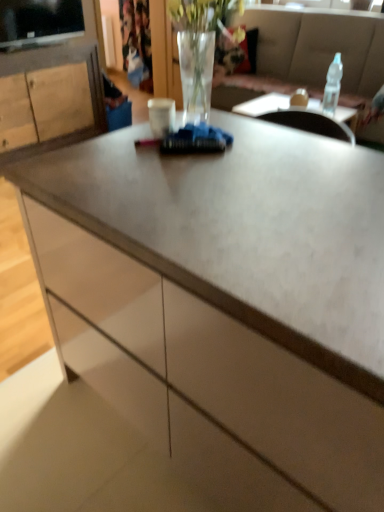
The image size is (384, 512). Identify the location of translucent glass vase at upper center. (229, 47).

What do you see at coordinates (200, 47) in the screenshot? I see `clear glass vase at center` at bounding box center [200, 47].

In order to face clear plastic bottle at upper right, should I rotate leftwards or rightwards?

A 18.388 degree turn to the right will do.

The image size is (384, 512). What do you see at coordinates (319, 45) in the screenshot? I see `matte gray couch at upper center` at bounding box center [319, 45].

You are a GUI agent. You are given a task and a screenshot of the screen. Output one action in this format:
    pyautogui.click(x=<x>, y=<y>)
    Task: Click on the black glossy television at upper left
    
    Given the screenshot: What is the action you would take?
    pyautogui.click(x=39, y=21)

Are black glossy television at upper left and matte gray couch at upper center making contact?

No, black glossy television at upper left is not with matte gray couch at upper center.

Considering the positions of point (21, 34) and point (302, 63), is point (21, 34) closer or farther from the camera than point (302, 63)?

Point (21, 34) is closer to the camera than point (302, 63).

Looking at their sizes, would you say black glossy television at upper left is wider or thinner than matte gray couch at upper center?

black glossy television at upper left is thinner than matte gray couch at upper center.

What's the angular difference between black glossy television at upper left and matte gray couch at upper center's facing directions?

There is a 88.5-degree angle between the facing directions of black glossy television at upper left and matte gray couch at upper center.

Considering the relative positions of clear glass vase at center and matte gray couch at upper center in the image provided, is clear glass vase at center behind matte gray couch at upper center?

No, it is in front of matte gray couch at upper center.

Is clear glass vase at center looking in the opposite direction of matte gray couch at upper center?

No, clear glass vase at center's orientation is not away from matte gray couch at upper center.

Which is more to the right, clear glass vase at center or matte gray couch at upper center?

Positioned to the right is matte gray couch at upper center.

Does clear glass vase at center touch matte gray couch at upper center?

There is a gap between clear glass vase at center and matte gray couch at upper center.

Which is more to the left, clear plastic bottle at upper right or matte gray couch at upper center?

clear plastic bottle at upper right is more to the left.

In the scene shown: Which of these two, clear plastic bottle at upper right or matte gray couch at upper center, is bigger?

Bigger between the two is matte gray couch at upper center.

This screenshot has width=384, height=512. In the image, there is a clear plastic bottle at upper right. What are the coordinates of `studio couch below it (from a real-world perspective)` in the screenshot? It's located at (319, 45).

Which is behind, clear plastic bottle at upper right or matte gray couch at upper center?

clear plastic bottle at upper right is behind.

From the image's perspective, does matte gray couch at upper center appear higher than translucent glass vase at upper center?

No.

From a real-world perspective, between matte gray couch at upper center and translucent glass vase at upper center, who is vertically higher?

A: translucent glass vase at upper center, from a real-world perspective.

Does matte gray couch at upper center have a lesser width compared to translucent glass vase at upper center?

In fact, matte gray couch at upper center might be wider than translucent glass vase at upper center.

From the image's perspective, relative to wooden cabinet at left, is matte gray couch at upper center above or below?

matte gray couch at upper center is situated higher than wooden cabinet at left in the image.

From a real-world perspective, is matte gray couch at upper center physically below wooden cabinet at left?

No, from a real-world perspective, matte gray couch at upper center is not beneath wooden cabinet at left.

Could wooden cabinet at left be considered to be inside matte gray couch at upper center?

No, wooden cabinet at left is not surrounded by matte gray couch at upper center.

You are a GUI agent. You are given a task and a screenshot of the screen. Output one action in this format:
    pyautogui.click(x=<x>, y=<y>)
    Task: Click on the cabinetry behind the matte gray couch at upper center
    
    Given the screenshot: What is the action you would take?
    pyautogui.click(x=50, y=98)

Considering the sizes of objects wooden cabinet at left and translucent glass vase at upper center in the image provided, who is wider, wooden cabinet at left or translucent glass vase at upper center?

wooden cabinet at left is wider.

At what (x,y) coordinates should I click in order to perform the action: click on flower on the right of the wooden cabinet at left. Please return your answer as a coordinate pair (x, y). The width and height of the screenshot is (384, 512). Looking at the image, I should click on (229, 47).

Can we say wooden cabinet at left lies outside translucent glass vase at upper center?

That's correct, wooden cabinet at left is outside of translucent glass vase at upper center.

Is point (8, 156) closer or farther from the camera than point (240, 50)?

Point (8, 156) is positioned closer to the camera compared to point (240, 50).

Which is correct: black glossy television at upper left is inside clear plastic bottle at upper right, or outside of it?

black glossy television at upper left exists outside the volume of clear plastic bottle at upper right.

Which of these two, black glossy television at upper left or clear plastic bottle at upper right, stands taller?

With more height is clear plastic bottle at upper right.

Based on the photo, is black glossy television at upper left with clear plastic bottle at upper right?

No.

Locate an element on the screen. This screenshot has height=512, width=384. television located above the matte gray couch at upper center (from a real-world perspective) is located at coordinates (39, 21).

The width and height of the screenshot is (384, 512). What are the coordinates of `studio couch above the clear glass vase at center (from the image's perspective)` in the screenshot? It's located at (319, 45).

Looking at the image, which one is located further to black glossy television at upper left, wooden cabinet at left or clear plastic bottle at upper right?

Among the two, clear plastic bottle at upper right is located further to black glossy television at upper left.

Considering their positions, is translucent glass vase at upper center positioned closer to matte gray couch at upper center than clear plastic bottle at upper right?

translucent glass vase at upper center is closer to matte gray couch at upper center.

Considering their positions, is wooden cabinet at left positioned further to black glossy television at upper left than translucent glass vase at upper center?

The object further to black glossy television at upper left is translucent glass vase at upper center.

Based on their spatial positions, is translucent glass vase at upper center or clear plastic bottle at upper right further from black glossy television at upper left?

Among the two, clear plastic bottle at upper right is located further to black glossy television at upper left.

Which object lies further to the anchor point wooden cabinet at left, clear glass vase at center or clear plastic bottle at upper right?

Based on the image, clear plastic bottle at upper right appears to be further to wooden cabinet at left.

Estimate the real-world distances between objects in this image. Which object is closer to wooden cabinet at left, clear plastic bottle at upper right or clear glass vase at center?

clear glass vase at center is positioned closer to the anchor wooden cabinet at left.

Looking at this image, estimate the real-world distances between objects in this image. Which object is further from clear glass vase at center, black glossy television at upper left or clear plastic bottle at upper right?

clear plastic bottle at upper right is further to clear glass vase at center.

Looking at this image, from the image, which object appears to be nearer to clear glass vase at center, wooden cabinet at left or clear plastic bottle at upper right?

clear plastic bottle at upper right lies closer to clear glass vase at center than the other object.

You are a GUI agent. You are given a task and a screenshot of the screen. Output one action in this format:
    pyautogui.click(x=<x>, y=<y>)
    Task: Click on the cabinetry positioned between clear glass vase at center and translucent glass vase at upper center from near to far
    This screenshot has height=512, width=384.
    Given the screenshot: What is the action you would take?
    pyautogui.click(x=50, y=98)

What are the coordinates of `floral arrangement between black glossy television at upper left and clear plastic bottle at upper right in the horizontal direction` in the screenshot? It's located at (200, 47).

Find the location of `flower between black glossy television at upper left and matte gray couch at upper center from left to right`. flower between black glossy television at upper left and matte gray couch at upper center from left to right is located at coordinates (229, 47).

This screenshot has width=384, height=512. I want to click on television located between wooden cabinet at left and translucent glass vase at upper center in the left-right direction, so click(39, 21).